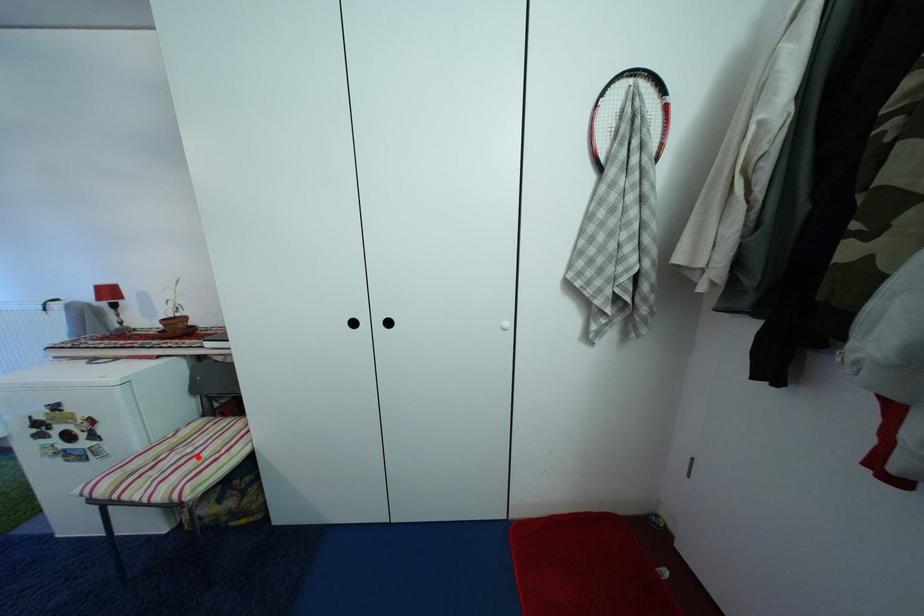
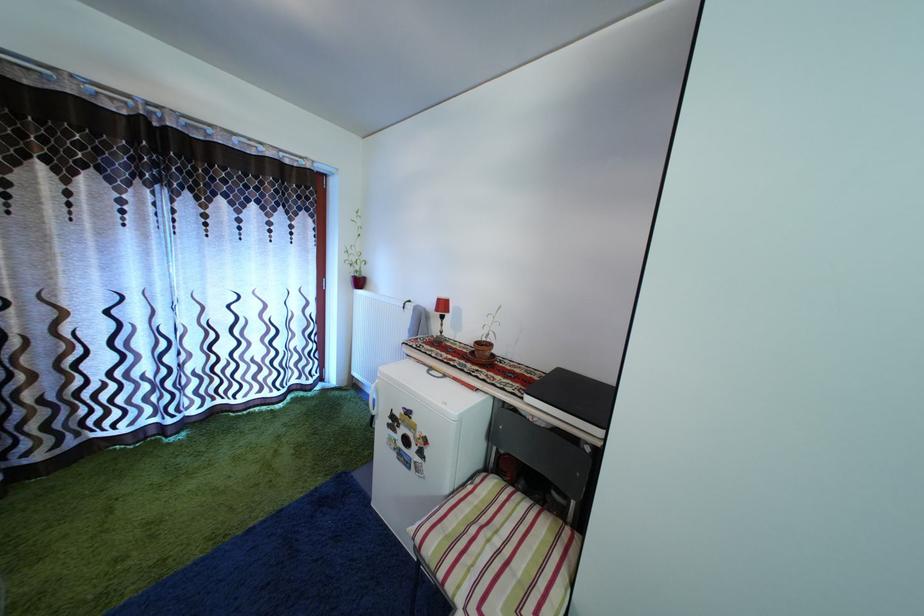
In the second image, find the point that corresponds to the highlighted location in the first image.

(505, 549)